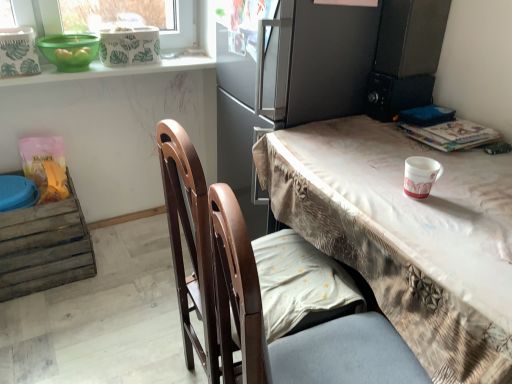
Measure the distance between green plastic bowl at upper left and camera.

green plastic bowl at upper left and camera are 1.72 meters apart.

Image resolution: width=512 pixels, height=384 pixels. Describe the element at coordinates (420, 176) in the screenshot. I see `white paper cup at right` at that location.

Identify the location of weathered wood crate at lower left. This screenshot has width=512, height=384. (44, 247).

Image resolution: width=512 pixels, height=384 pixels. Describe the element at coordinates (44, 247) in the screenshot. I see `weathered wood crate at lower left` at that location.

This screenshot has height=384, width=512. What do you see at coordinates (69, 51) in the screenshot? I see `green plastic bowl at upper left` at bounding box center [69, 51].

Identify the location of green plastic bowl at upper left. (112, 70).

This screenshot has height=384, width=512. What are the coordinates of `chair in front of the hardcover book at upper right` in the screenshot? It's located at (258, 295).

From the image's perspective, is hardcover book at upper right above or below brown wooden chair at center?

hardcover book at upper right is above brown wooden chair at center.

Is point (494, 139) closer to viewer compared to point (296, 353)?

No, it is behind (296, 353).

From a real-world perspective, is white paper cup at right above or below green plastic bowl at upper left?

white paper cup at right is situated lower than green plastic bowl at upper left in the real world.

How different are the orientations of white paper cup at right and green plastic bowl at upper left in degrees?

97.7 degrees separate the facing orientations of white paper cup at right and green plastic bowl at upper left.

From the picture: Is white paper cup at right touching green plastic bowl at upper left?

No, white paper cup at right is not beside green plastic bowl at upper left.

Is white paper cup at right looking in the opposite direction of green plastic bowl at upper left?

That's not correct — white paper cup at right is not looking away from green plastic bowl at upper left.

Considering the sizes of objects green plastic bowl at upper left and weathered wood crate at lower left in the image provided, who is taller, green plastic bowl at upper left or weathered wood crate at lower left?

weathered wood crate at lower left is taller.

Can you confirm if green plastic bowl at upper left is bigger than weathered wood crate at lower left?

Incorrect, green plastic bowl at upper left is not larger than weathered wood crate at lower left.

Which is farther from the camera, (62, 52) or (33, 267)?

The point (33, 267) is farther from the camera.

From the picture: Is weathered wood crate at lower left surrounded by green plastic bowl at upper left?

No, weathered wood crate at lower left is not a part of green plastic bowl at upper left.

From a real-world perspective, which is physically above, green plastic bowl at upper left or green plastic bowl at upper left?

green plastic bowl at upper left.

Is green plastic bowl at upper left in front of green plastic bowl at upper left?

Yes, green plastic bowl at upper left is closer to the viewer.

Can you confirm if green plastic bowl at upper left is bigger than green plastic bowl at upper left?

Actually, green plastic bowl at upper left might be smaller than green plastic bowl at upper left.

How much distance is there between green plastic bowl at upper left and white paper cup at right?

green plastic bowl at upper left is 4.38 feet from white paper cup at right.

Could you tell me if green plastic bowl at upper left is facing white paper cup at right?

Yes.

Is green plastic bowl at upper left to the left of white paper cup at right from the viewer's perspective?

Yes.

Is green plastic bowl at upper left not close to white paper cup at right?

green plastic bowl at upper left is far away from white paper cup at right.

Considering the positions of objects white paper cup at right and floral-patterned fabric table at right in the image provided, who is more to the left, white paper cup at right or floral-patterned fabric table at right?

Positioned to the left is white paper cup at right.

Which of these two, white paper cup at right or floral-patterned fabric table at right, is thinner?

Thinner between the two is white paper cup at right.

From their relative heights in the image, would you say white paper cup at right is taller or shorter than floral-patterned fabric table at right?

white paper cup at right is shorter than floral-patterned fabric table at right.

Is weathered wood crate at lower left in contact with floral-patterned fabric table at right?

weathered wood crate at lower left and floral-patterned fabric table at right are clearly separated.

Can you confirm if weathered wood crate at lower left is taller than floral-patterned fabric table at right?

Incorrect, the height of weathered wood crate at lower left is not larger of that of floral-patterned fabric table at right.

Does weathered wood crate at lower left have a lesser width compared to floral-patterned fabric table at right?

Indeed, weathered wood crate at lower left has a lesser width compared to floral-patterned fabric table at right.

Which is more to the left, weathered wood crate at lower left or floral-patterned fabric table at right?

weathered wood crate at lower left.

The width and height of the screenshot is (512, 384). Identify the location of magazine above the brown wooden chair at center (from a real-world perspective). (452, 135).

Locate an element on the screen. bowl located on the left of white paper cup at right is located at coordinates (69, 51).

Looking at the image, which one is located further to weathered wood crate at lower left, floral-patterned fabric table at right or green plastic bowl at upper left?

Based on the image, floral-patterned fabric table at right appears to be further to weathered wood crate at lower left.

Estimate the real-world distances between objects in this image. Which object is closer to matte gray fridge at upper center, hardcover book at upper right or weathered wood crate at lower left?

Based on the image, hardcover book at upper right appears to be nearer to matte gray fridge at upper center.

Based on the photo, based on their spatial positions, is weathered wood crate at lower left or floral-patterned fabric table at right further from green plastic bowl at upper left?

floral-patterned fabric table at right is positioned further to the anchor green plastic bowl at upper left.

Based on their spatial positions, is green plastic bowl at upper left or weathered wood crate at lower left further from green plastic bowl at upper left?

weathered wood crate at lower left lies further to green plastic bowl at upper left than the other object.

From the image, which object appears to be farther from white paper cup at right, brown wooden chair at center or matte gray fridge at upper center?

The object further to white paper cup at right is matte gray fridge at upper center.

Which object lies further to the anchor point white paper cup at right, floral-patterned fabric table at right or weathered wood crate at lower left?

Based on the image, weathered wood crate at lower left appears to be further to white paper cup at right.

When comparing their distances from floral-patterned fabric table at right, does green plastic bowl at upper left or matte gray fridge at upper center seem further?

Based on the image, green plastic bowl at upper left appears to be further to floral-patterned fabric table at right.

From the image, which object appears to be farther from white paper cup at right, weathered wood crate at lower left or brown wooden chair at center?

Among the two, weathered wood crate at lower left is located further to white paper cup at right.

This screenshot has height=384, width=512. I want to click on chair situated between green plastic bowl at upper left and white paper cup at right from left to right, so click(x=258, y=295).

Where is `paper cup between green plastic bowl at upper left and hardcover book at upper right in the horizontal direction`? paper cup between green plastic bowl at upper left and hardcover book at upper right in the horizontal direction is located at coordinates (420, 176).

Image resolution: width=512 pixels, height=384 pixels. In order to click on paper cup located between brown wooden chair at center and floral-patterned fabric table at right in the left-right direction in this screenshot , I will do `click(420, 176)`.

Identify the location of chair between floral-patterned fabric table at right and hardcover book at upper right in the front-back direction. This screenshot has height=384, width=512. (258, 295).